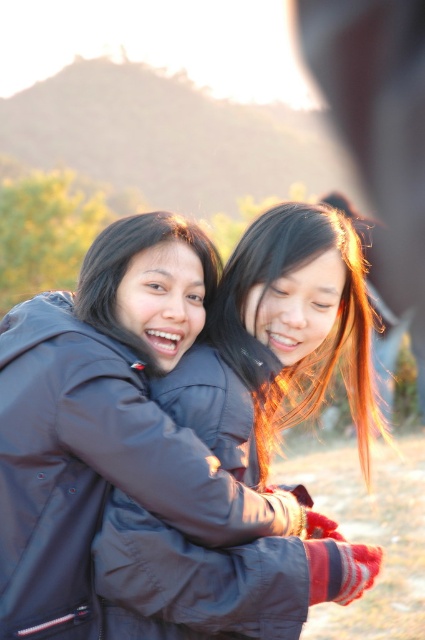
You are a photographer adjusting the focus on your camera. You want to ensure both the matte black jacket at center and the shiny black hair at center are in focus. Given their distance apart, can you achieve this with a single shot?

The matte black jacket at center and the shiny black hair at center are 5.43 inches apart. With proper focus adjustment, a single shot can capture both in focus since the distance between them is manageable within the depth of field.

You are standing in the scene and want to walk towards the point at coordinates point (289, 291) and point (323, 214). Which point will you reach first?

Point (289, 291) is in front of point (323, 214), so you will reach point (289, 291) first.

You are a photographer adjusting your camera settings to capture the golden hour lighting. You notice the matte black jacket at center and the shiny black hair at center. Which object is positioned to the left of the other?

The matte black jacket at center is positioned on the left side of shiny black hair at center.